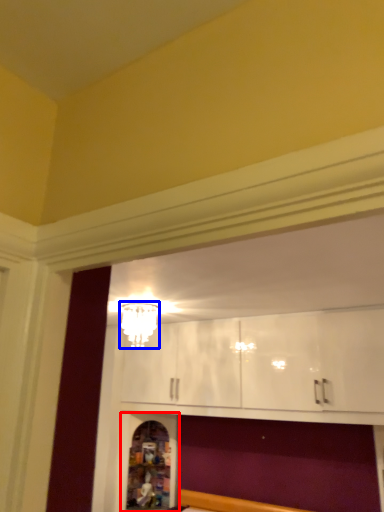
Question: Which of the following is the closest to the observer, shelf (highlighted by a red box) or light fixture (highlighted by a blue box)?

Choices:
 (A) shelf
 (B) light fixture

Answer: (B)